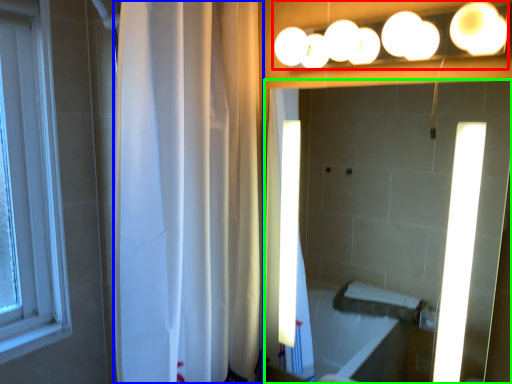
Question: Estimate the real-world distances between objects in this image. Which object is farther from fixture (highlighted by a red box), shower curtain (highlighted by a blue box) or mirror (highlighted by a green box)?

Choices:
 (A) shower curtain
 (B) mirror

Answer: (B)